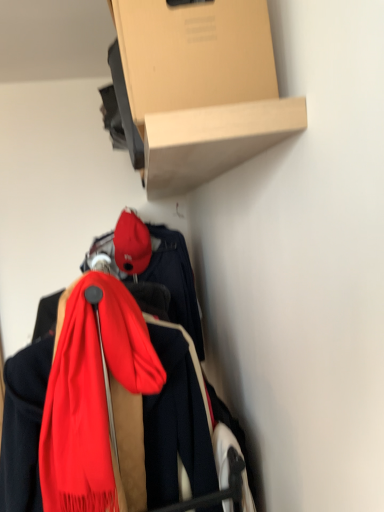
Describe the element at coordinates (131, 244) in the screenshot. I see `matte red cap at center` at that location.

Looking at this image, measure the distance between point (120, 28) and camera.

Point (120, 28) is 27.28 inches away from camera.

Locate an element on the screen. This screenshot has height=512, width=384. cardboard box at upper center is located at coordinates (194, 54).

What do you see at coordinates (97, 402) in the screenshot? I see `silky red scarf at center` at bounding box center [97, 402].

The height and width of the screenshot is (512, 384). Find the location of `matte red cap at center`. matte red cap at center is located at coordinates (131, 244).

Does silky red scarf at center have a greater width compared to cardboard box at upper center?

Indeed, silky red scarf at center has a greater width compared to cardboard box at upper center.

From the image's perspective, is silky red scarf at center positioned above or below cardboard box at upper center?

From the image's perspective, silky red scarf at center appears below cardboard box at upper center.

From the picture: From a real-world perspective, is silky red scarf at center over cardboard box at upper center?

Incorrect, from a real-world perspective, silky red scarf at center is lower than cardboard box at upper center.

How different are the orientations of silky red scarf at center and matte red cap at center in degrees?

They differ by 0.00154 degrees in their facing directions.

Measure the distance between silky red scarf at center and matte red cap at center.

A distance of 31.84 inches exists between silky red scarf at center and matte red cap at center.

Does silky red scarf at center have a greater height compared to matte red cap at center?

Indeed, silky red scarf at center has a greater height compared to matte red cap at center.

Which object is more forward, silky red scarf at center or matte red cap at center?

silky red scarf at center is more forward.

Who is smaller, cardboard box at upper center or matte red cap at center?

With smaller size is matte red cap at center.

In the scene shown: From the image's perspective, would you say cardboard box at upper center is shown under matte red cap at center?

Actually, cardboard box at upper center appears above matte red cap at center in the image.

Considering the relative positions of cardboard box at upper center and matte red cap at center in the image provided, is cardboard box at upper center to the left of matte red cap at center from the viewer's perspective?

No.

Is cardboard box at upper center next to matte red cap at center?

cardboard box at upper center is not next to matte red cap at center, and they're not touching.

From the image's perspective, between matte red cap at center and cardboard box at upper center, which one is located above?

cardboard box at upper center, from the image's perspective.

Find the location of a particular element. The height and width of the screenshot is (512, 384). cardboard box above the matte red cap at center (from a real-world perspective) is located at coordinates (194, 54).

What's the angular difference between matte red cap at center and cardboard box at upper center's facing directions?

There is a 5.01-degree angle between the facing directions of matte red cap at center and cardboard box at upper center.

Considering their positions, is matte red cap at center located in front of or behind cardboard box at upper center?

Visually, matte red cap at center is located behind cardboard box at upper center.

In the image, is cardboard box at upper center on the left side or the right side of silky red scarf at center?

Clearly, cardboard box at upper center is on the right of silky red scarf at center in the image.

Is cardboard box at upper center oriented towards silky red scarf at center?

No, cardboard box at upper center is not aimed at silky red scarf at center.

Does point (127, 11) come farther from viewer compared to point (104, 392)?

No, it is in front of (104, 392).

Looking at this image, considering the relative sizes of matte red cap at center and silky red scarf at center in the image provided, is matte red cap at center bigger than silky red scarf at center?

No.

How different are the orientations of matte red cap at center and silky red scarf at center in degrees?

0.00154 degrees separate the facing orientations of matte red cap at center and silky red scarf at center.

Does matte red cap at center turn towards silky red scarf at center?

No, matte red cap at center is not aimed at silky red scarf at center.

Is matte red cap at center next to silky red scarf at center?

matte red cap at center is not next to silky red scarf at center, and they're not touching.

Locate an element on the screen. cardboard box to the right of silky red scarf at center is located at coordinates (194, 54).

Locate an element on the screen. The image size is (384, 512). hat positioned vertically above the silky red scarf at center (from a real-world perspective) is located at coordinates (131, 244).

Looking at the image, which one is located closer to matte red cap at center, cardboard box at upper center or silky red scarf at center?

silky red scarf at center.

Considering their positions, is silky red scarf at center positioned further to cardboard box at upper center than matte red cap at center?

Based on the image, matte red cap at center appears to be further to cardboard box at upper center.

Which object lies further to the anchor point cardboard box at upper center, matte red cap at center or silky red scarf at center?

matte red cap at center.

From the image, which object appears to be farther from matte red cap at center, silky red scarf at center or cardboard box at upper center?

cardboard box at upper center.

Which object lies further to the anchor point silky red scarf at center, matte red cap at center or cardboard box at upper center?

Based on the image, matte red cap at center appears to be further to silky red scarf at center.

Which object lies further to the anchor point silky red scarf at center, cardboard box at upper center or matte red cap at center?

Based on the image, matte red cap at center appears to be further to silky red scarf at center.

This screenshot has height=512, width=384. I want to click on scarf between cardboard box at upper center and matte red cap at center along the z-axis, so click(x=97, y=402).